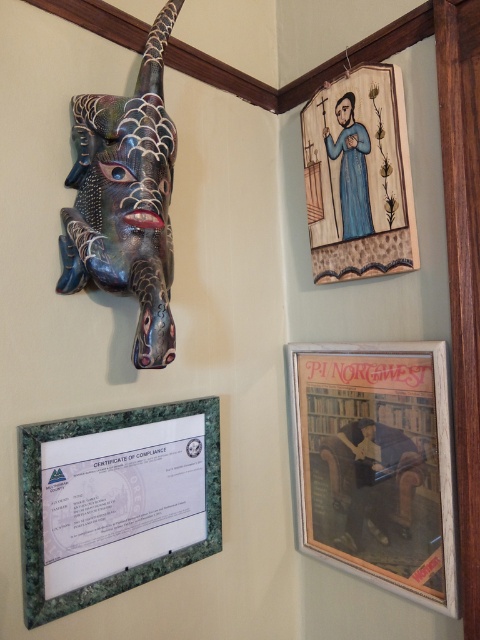
You are an interior designer assessing the wall layout. You need to determine if the wooden framed poster at lower right can be placed to the left of the wooden painted figure at upper right without overlapping. Based on their widths, is this possible?

The wooden framed poster at lower right might be wider than wooden painted figure at upper right, so there is a possibility of overlap if placed to the left. To avoid overlapping, ensure there is sufficient space between them considering the poster might be wider.

You are hanging a new picture on the wall and want to ensure it aligns with the existing decor. Based on the scene, where should you place the new picture if you want it to be positioned above the wooden framed poster at lower right but still below the metallic textured mask at upper left?

The new picture should be placed between the wooden framed poster at lower right and the metallic textured mask at upper left since the wooden framed poster at lower right is below the metallic textured mask at upper left.

You are standing in front of the wall and want to hang a new picture. The wooden framed poster at lower right is located at point (376,465). Where should you place your new picture so it is to the left of the wooden framed poster at lower right?

To place your new picture to the left of the wooden framed poster at lower right, you should position it at a coordinate with an x value less than 0.727, maintaining the same y value of 0.785.